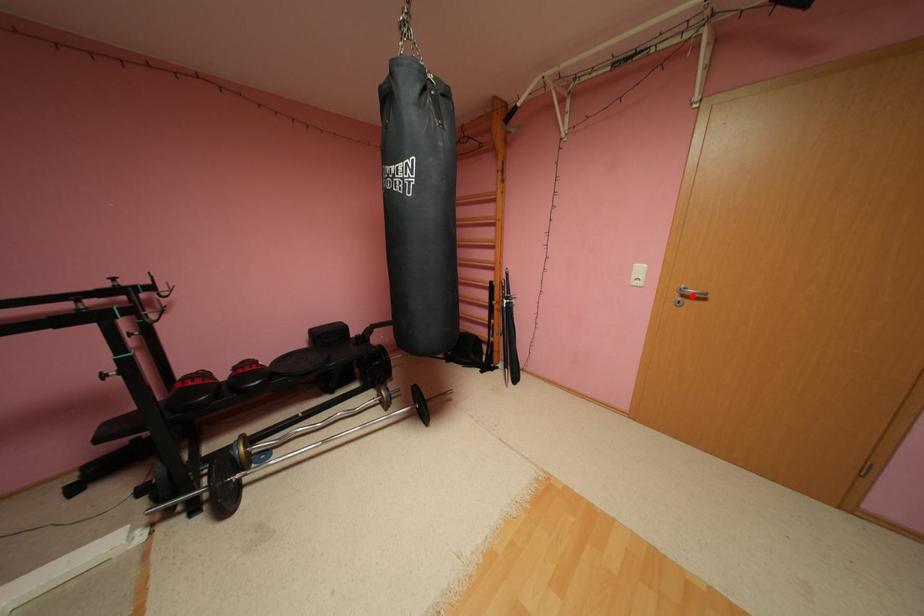
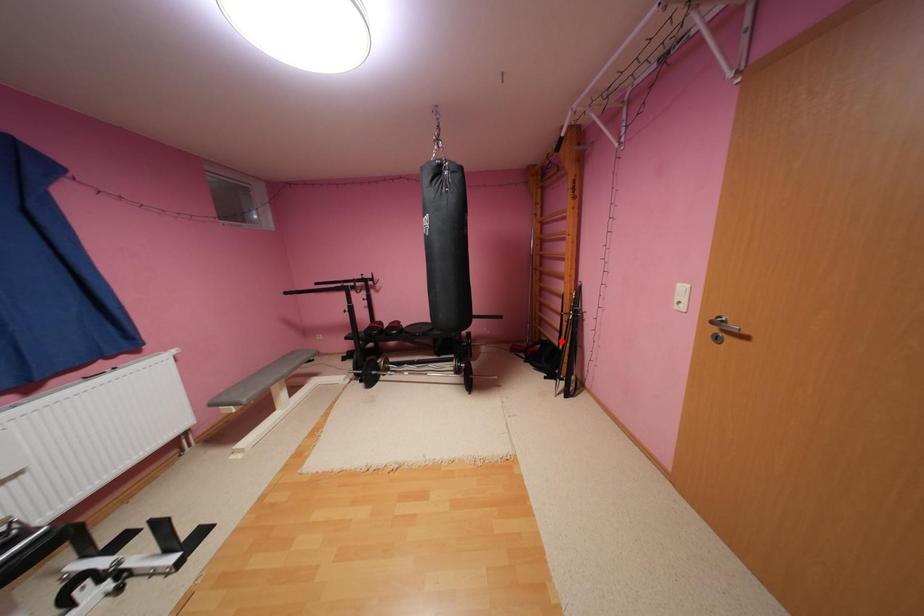
I am providing you with two images of the same scene from different viewpoints. A red point is marked on the first image and another point is marked on the second image. Is the red point in image1 aligned with the point shown in image2?

No